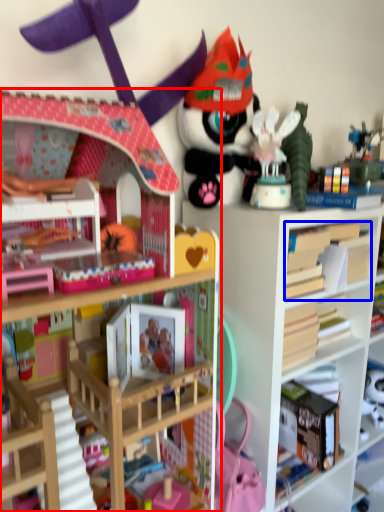
Question: Which object is closer to the camera taking this photo, bookcase (highlighted by a red box) or book (highlighted by a blue box)?

Choices:
 (A) bookcase
 (B) book

Answer: (A)